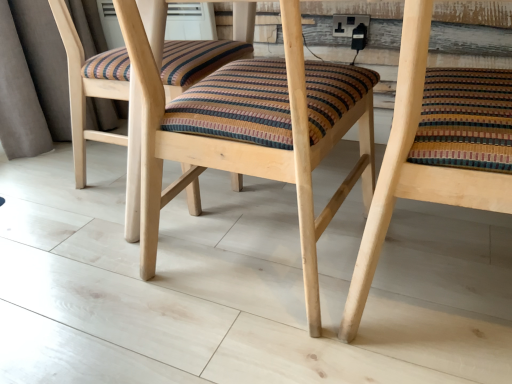
Find the location of a particular element. The width and height of the screenshot is (512, 384). vacant space that's between wooden chair at center, the 1th chair viewed from the left, and wooden chair at center, which appears as the 2th chair when viewed from the left is located at coordinates (371, 332).